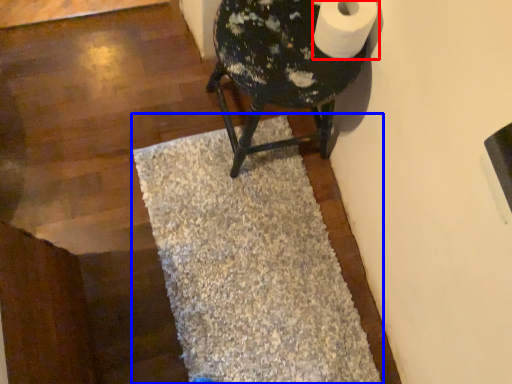
Question: Which point is closer to the camera, toilet paper (highlighted by a red box) or bath mat (highlighted by a blue box)?

Choices:
 (A) toilet paper
 (B) bath mat

Answer: (A)